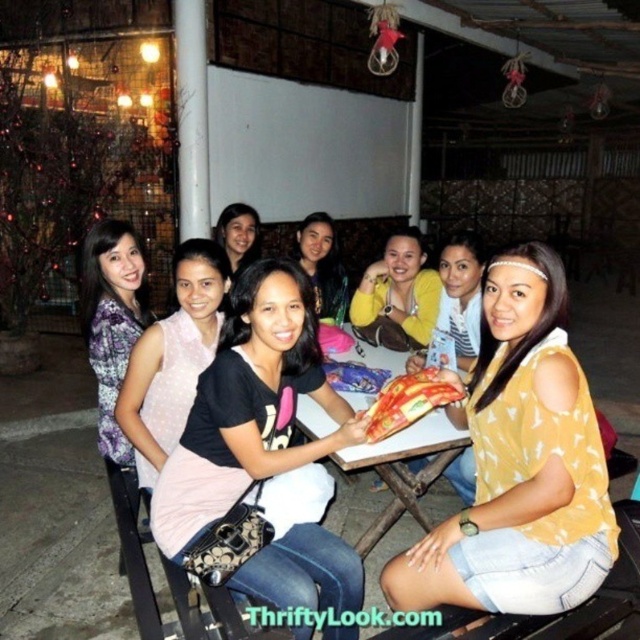
Does matte black dress at center appear under yellow matte sweater at center?

Yes, matte black dress at center is below yellow matte sweater at center.

Which is below, matte black dress at center or yellow matte sweater at center?

matte black dress at center is lower down.

The image size is (640, 640). Describe the element at coordinates (172, 358) in the screenshot. I see `matte black dress at center` at that location.

Identify the location of matte black dress at center. pos(172,358).

Is yellow printed top at center thinner than black matte shirt at center?

No.

Does point (502, 356) come closer to viewer compared to point (307, 218)?

Yes.

This screenshot has width=640, height=640. Find the location of `yellow printed top at center`. yellow printed top at center is located at coordinates (518, 464).

What do you see at coordinates (172, 358) in the screenshot? I see `matte black dress at center` at bounding box center [172, 358].

Who is higher up, matte black dress at center or white plastic table at center?

matte black dress at center is higher up.

At what (x,y) coordinates should I click in order to perform the action: click on matte black dress at center. Please return your answer as a coordinate pair (x, y). The width and height of the screenshot is (640, 640). Looking at the image, I should click on (172, 358).

The height and width of the screenshot is (640, 640). Identify the location of matte black dress at center. (172, 358).